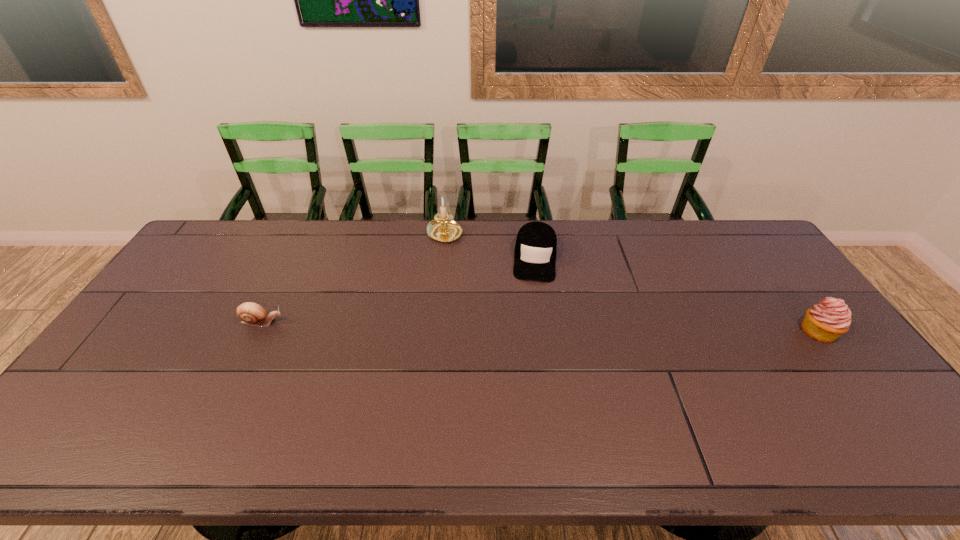
Where is `free space at the near edge`? free space at the near edge is located at coordinates (444, 395).

In the image, there is a desktop. Where is `vacant space at the left edge`? This screenshot has height=540, width=960. vacant space at the left edge is located at coordinates (186, 288).

Image resolution: width=960 pixels, height=540 pixels. Identify the location of free spot at the far right corner of the desktop. (718, 247).

The height and width of the screenshot is (540, 960). In the image, there is a desktop. In order to click on vacant area at the near right corner in this screenshot , I will do 853,418.

This screenshot has height=540, width=960. Identify the location of free space that is in between the second object from right to left and the rightmost object. (677, 295).

Image resolution: width=960 pixels, height=540 pixels. In order to click on free space between the second object from left to right and the second tallest object in this screenshot , I will do `click(632, 283)`.

The image size is (960, 540). Identify the location of free point between the cap and the candle holder. (490, 246).

In order to click on vacant area between the escargot and the candle holder in this screenshot , I will do (x=353, y=278).

You are a GUI agent. You are given a task and a screenshot of the screen. Output one action in this format:
    pyautogui.click(x=<x>, y=<y>)
    Task: Click on the free space between the leftmost object and the cupcake
    This screenshot has width=960, height=540.
    Given the screenshot: What is the action you would take?
    pyautogui.click(x=540, y=327)

Where is `free space between the cap and the second object from left to right`? The image size is (960, 540). free space between the cap and the second object from left to right is located at coordinates (490, 246).